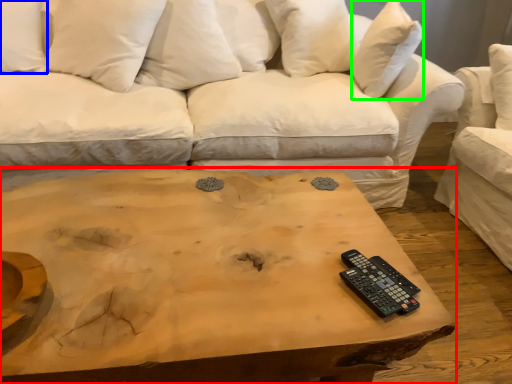
Question: Based on their relative distances, which object is farther from coffee table (highlighted by a red box)? Choose from pillow (highlighted by a blue box) and pillow (highlighted by a green box).

Choices:
 (A) pillow
 (B) pillow

Answer: (A)